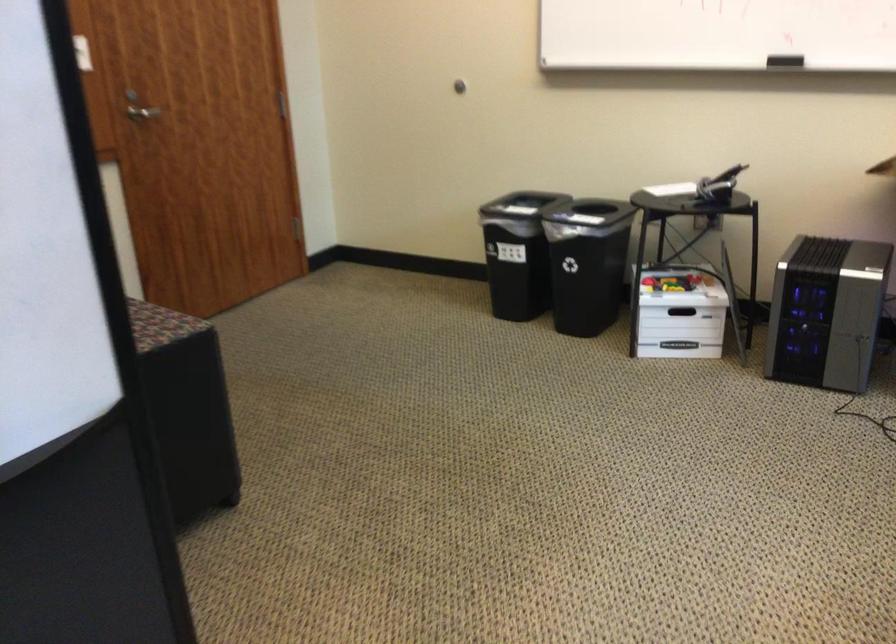
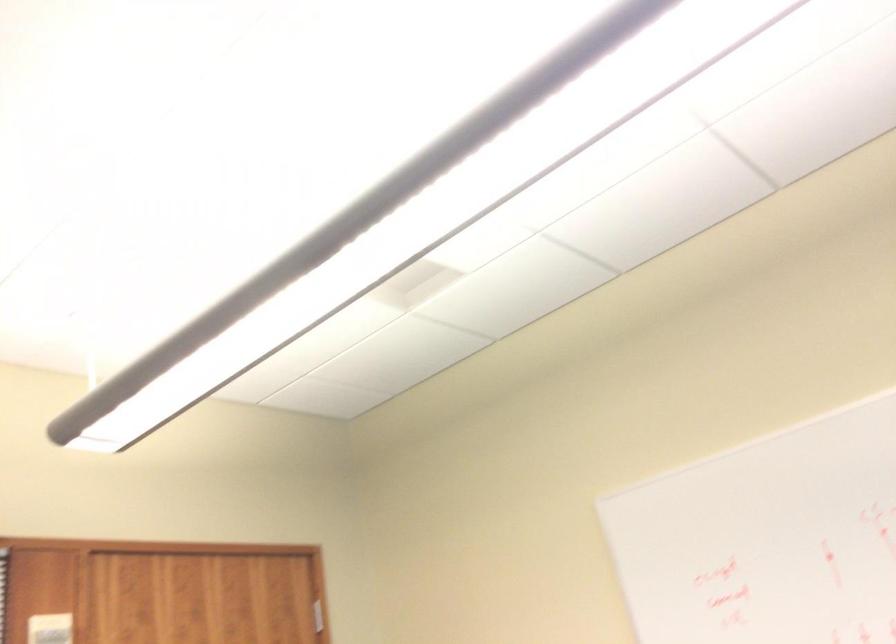
Question: How did the camera likely rotate?

Choices:
 (A) Left
 (B) Right
 (C) Up
 (D) Down

Answer: (C)